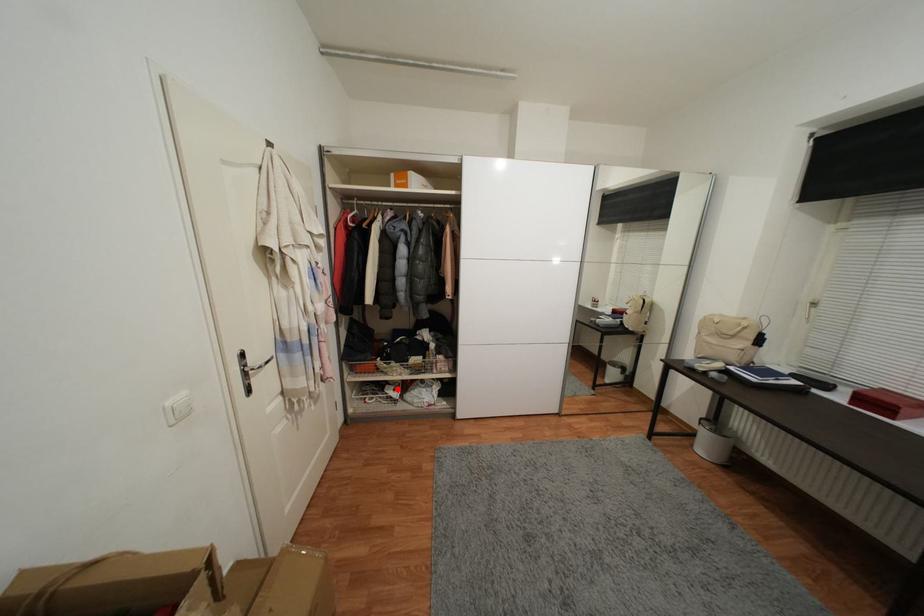
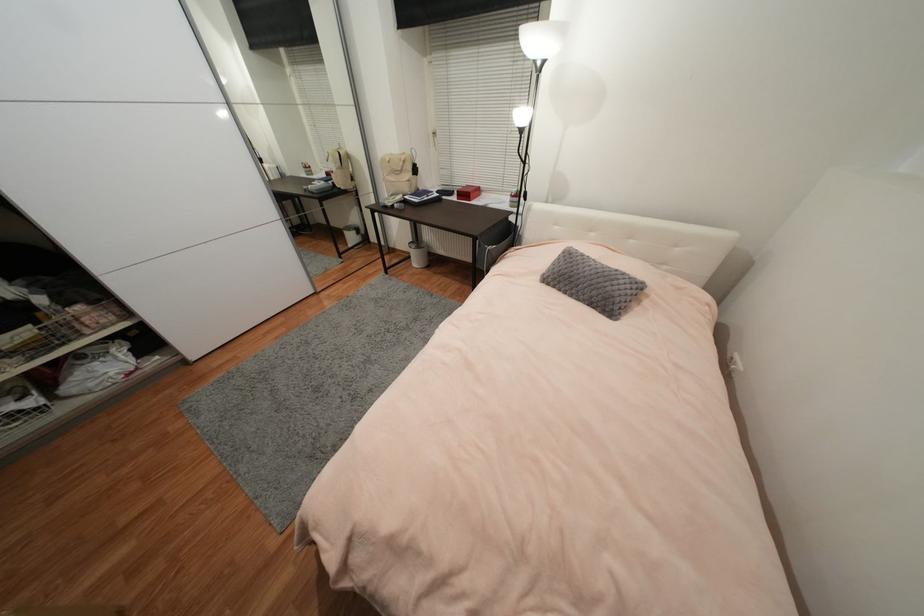
Locate, in the second image, the point that corresponds to the highlighted location in the first image.

(14, 400)